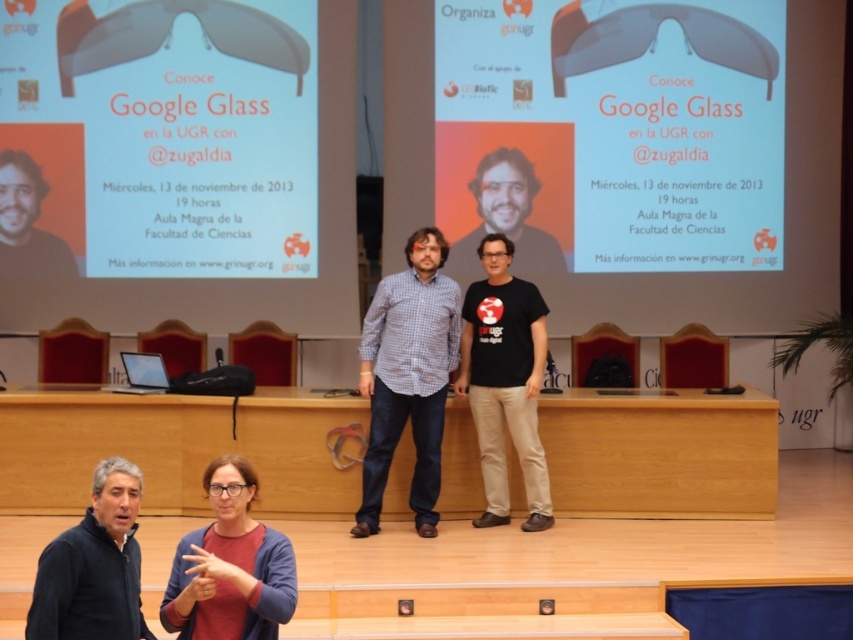
You are attending a lecture at the university and notice two presenters on stage. One is wearing a checkered fabric shirt at center and the other a matte blue sweater at lower center. Which presenter is closer to the front of the stage based on their clothing size?

The checkered fabric shirt at center has a larger size compared to the matte blue sweater at lower center, indicating that the presenter in the checkered fabric shirt at center is closer to the front of the stage since larger objects appear closer.

You are sitting in the audience of the presentation and want to know which of the two points, point (358, 509) or point (229, 515), is closer to you. Based on the scene description, can you determine which one is nearer?

Point (358, 509) is further to the viewer than point (229, 515). Therefore, point (229, 515) is closer to you.